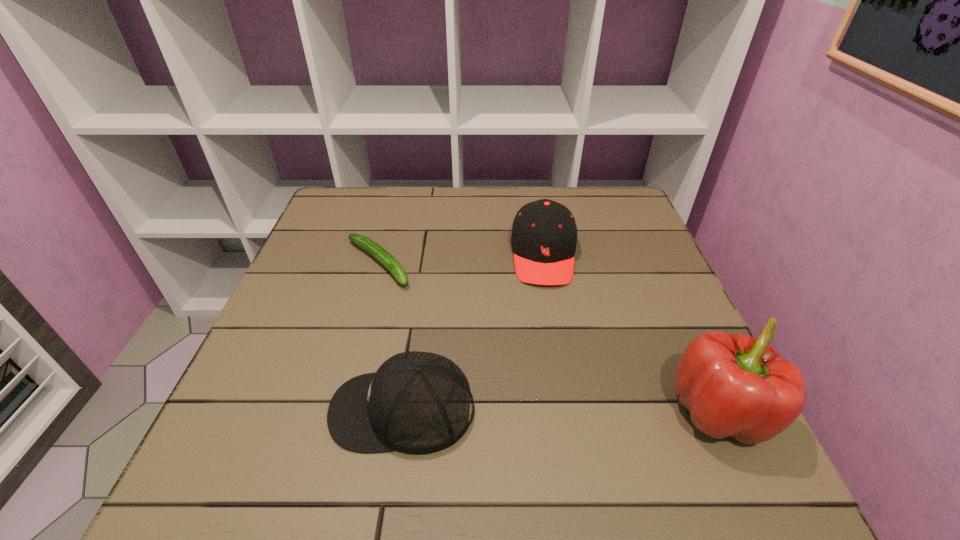
Where is `the left cap`? This screenshot has width=960, height=540. the left cap is located at coordinates (417, 403).

I want to click on pepper, so click(736, 385).

This screenshot has height=540, width=960. Find the location of `the tallest object`. the tallest object is located at coordinates point(736,385).

You are a GUI agent. You are given a task and a screenshot of the screen. Output one action in this format:
    pyautogui.click(x=<x>, y=<y>)
    Task: Click on the shortest object
    The image size is (960, 540).
    Given the screenshot: What is the action you would take?
    pyautogui.click(x=376, y=251)

Locate an element on the screen. Image resolution: width=960 pixels, height=540 pixels. the second object from right to left is located at coordinates (544, 234).

Identify the location of the farther cap. (544, 234).

This screenshot has width=960, height=540. In order to click on vacant space located 0.160m on the front-facing side of the left cap in this screenshot , I will do pos(240,409).

At what (x,y) coordinates should I click in order to perform the action: click on free space located on the front-facing side of the left cap. Please return your answer as a coordinate pair (x, y). Looking at the image, I should click on (279, 409).

Where is `vacant space located 0.290m on the left of the rightmost object`? This screenshot has width=960, height=540. vacant space located 0.290m on the left of the rightmost object is located at coordinates (504, 413).

Locate an element on the screen. This screenshot has width=960, height=540. blank area located 0.270m on the front-facing side of the shortest object is located at coordinates 473,351.